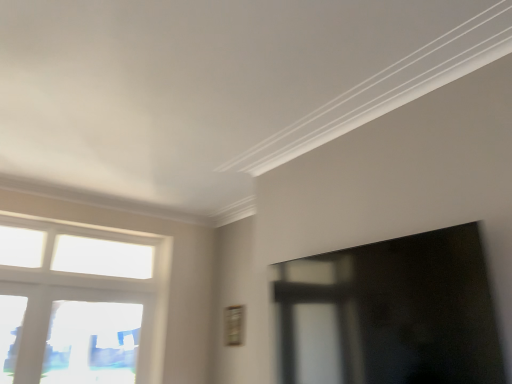
Question: From the image's perspective, is transparent glass window screen at right under white glass window at left, which appears as the second window when ordered from the bottom?

Choices:
 (A) no
 (B) yes

Answer: (A)

Question: Would you say transparent glass window screen at right contains white glass window at left, which appears as the second window when ordered from the bottom?

Choices:
 (A) no
 (B) yes

Answer: (A)

Question: Does transparent glass window screen at right have a larger size compared to white glass window at left, which appears as the second window when ordered from the bottom?

Choices:
 (A) no
 (B) yes

Answer: (B)

Question: Is transparent glass window screen at right smaller than white glass window at left, which appears as the second window when ordered from the bottom?

Choices:
 (A) no
 (B) yes

Answer: (A)

Question: Is there a large distance between transparent glass window screen at right and white glass window at left, arranged as the first window when viewed from the top?

Choices:
 (A) no
 (B) yes

Answer: (B)

Question: Is transparent glass window screen at right wider than white glass window at left, arranged as the first window when viewed from the top?

Choices:
 (A) no
 (B) yes

Answer: (B)

Question: Does white glass window at left, which appears as the second window when ordered from the bottom, have a smaller size compared to transparent glass window screen at right?

Choices:
 (A) no
 (B) yes

Answer: (B)

Question: From a real-world perspective, is white glass window at left, arranged as the first window when viewed from the top, over transparent glass window screen at right?

Choices:
 (A) no
 (B) yes

Answer: (B)

Question: Is transparent glass window screen at right a part of white glass window at left, arranged as the first window when viewed from the top?

Choices:
 (A) yes
 (B) no

Answer: (B)

Question: Is white glass window at left, arranged as the first window when viewed from the top, in front of transparent glass window screen at right?

Choices:
 (A) no
 (B) yes

Answer: (A)

Question: Does white glass window at left, arranged as the first window when viewed from the top, have a greater width compared to transparent glass window screen at right?

Choices:
 (A) no
 (B) yes

Answer: (A)

Question: Is transparent glass window screen at right positioned behind transparent glass window at lower left, placed as the 2th window when sorted from top to bottom?

Choices:
 (A) yes
 (B) no

Answer: (B)